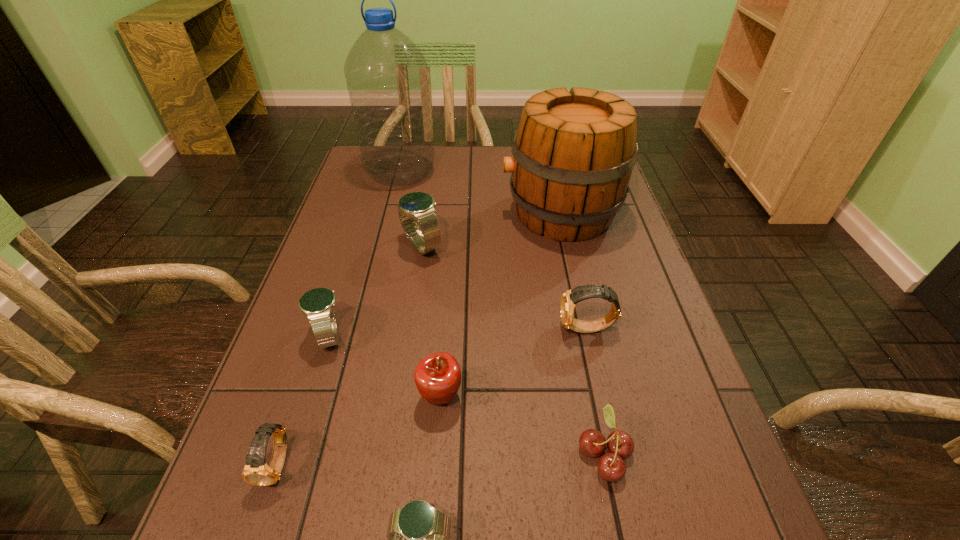
You are a GUI agent. You are given a task and a screenshot of the screen. Output one action in this format:
    pyautogui.click(x=<x>, y=<y>)
    Task: Click on the cherry
    The width and height of the screenshot is (960, 540).
    Given the screenshot: What is the action you would take?
    pyautogui.click(x=611, y=466)

This screenshot has width=960, height=540. Identify the location of the nearer gold watch. pyautogui.click(x=257, y=472).

Identify the location of the smaller gold watch. (257, 472).

I want to click on free spot located on the front of the water jug, so click(x=378, y=261).

This screenshot has width=960, height=540. I want to click on free location located 0.290m on the side of the eighth shortest object where the spigot is located, so click(x=400, y=213).

Identify the location of free space located 0.110m on the side of the eighth shortest object where the spigot is located. (464, 213).

Image resolution: width=960 pixels, height=540 pixels. I want to click on vacant point located on the side of the eighth shortest object where the spigot is located, so click(x=484, y=213).

Locate an element on the screen. The image size is (960, 540). vacant space located on the right of the biggest blue watch is located at coordinates (474, 246).

This screenshot has width=960, height=540. In order to click on free space located on the face of the rightmost watch in this screenshot , I will do `click(431, 329)`.

At what (x,y) coordinates should I click in order to perform the action: click on vacant space located on the face of the rightmost watch. Please return your answer as a coordinate pair (x, y). The image size is (960, 540). Looking at the image, I should click on (390, 329).